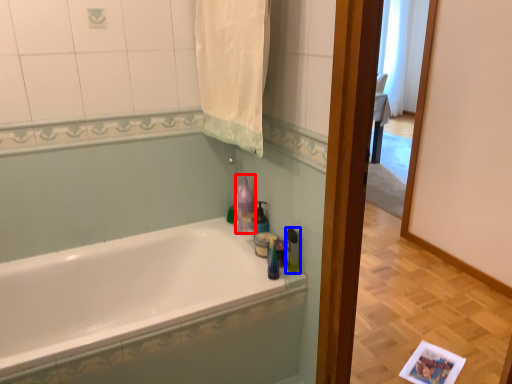
Question: Which object appears farthest to the camera in this image, cleaning product (highlighted by a red box) or toiletry (highlighted by a blue box)?

Choices:
 (A) cleaning product
 (B) toiletry

Answer: (A)